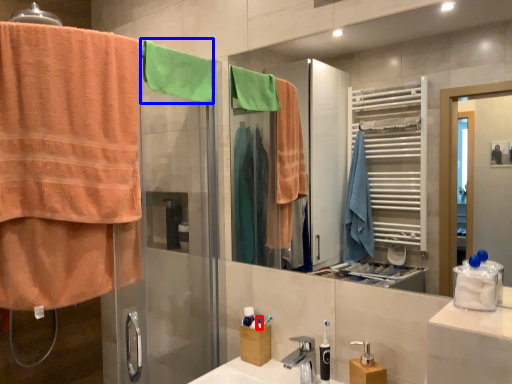
Question: Which point is closer to the camera, toiletry (highlighted by a red box) or beach towel (highlighted by a blue box)?

Choices:
 (A) toiletry
 (B) beach towel

Answer: (B)